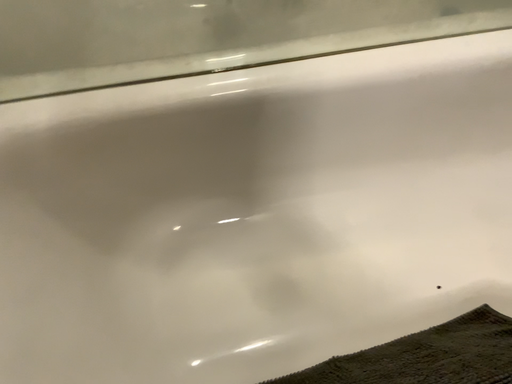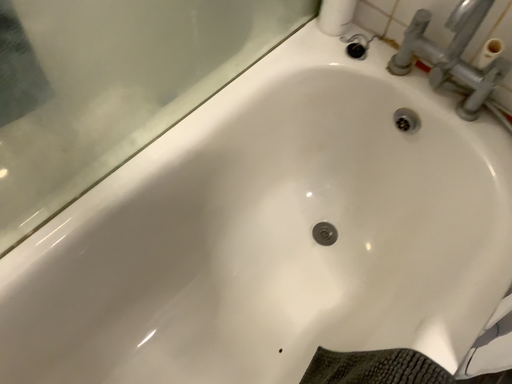
Question: Which way did the camera rotate in the video?

Choices:
 (A) rotated downward
 (B) rotated upward

Answer: (B)